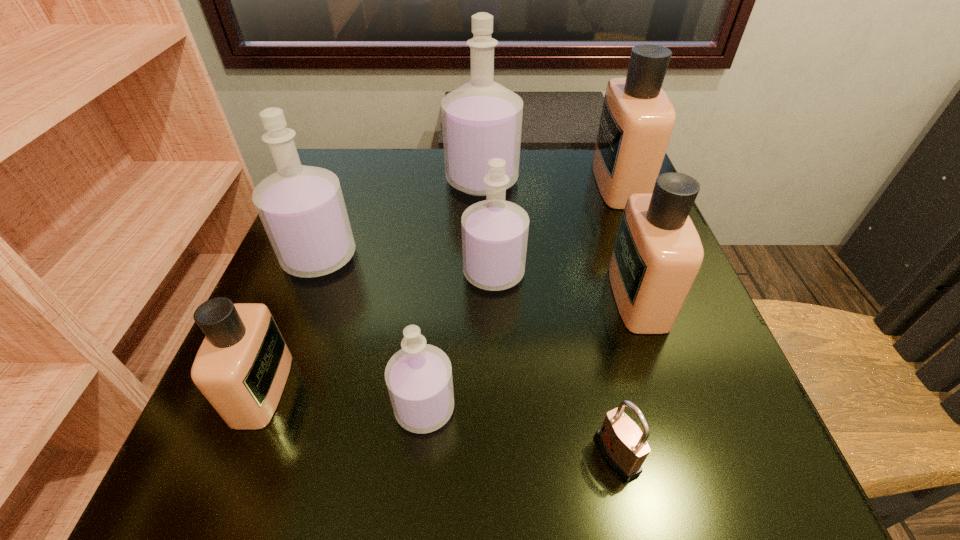
At what (x,y) coordinates should I click in order to perform the action: click on padlock. Please return your answer as a coordinate pair (x, y). The width and height of the screenshot is (960, 540). Looking at the image, I should click on (624, 446).

You are a GUI agent. You are given a task and a screenshot of the screen. Output one action in this format:
    pyautogui.click(x=<x>, y=<y>)
    Task: Click on the vacant area situated 0.290m on the right of the tallest object
    
    Given the screenshot: What is the action you would take?
    pyautogui.click(x=637, y=180)

You are a GUI agent. You are given a task and a screenshot of the screen. Output one action in this format:
    pyautogui.click(x=<x>, y=<y>)
    Task: Click on the vacant space located on the front label of the biggest beige perfume
    The height and width of the screenshot is (540, 960).
    Given the screenshot: What is the action you would take?
    pyautogui.click(x=483, y=183)

You are a GUI agent. You are given a task and a screenshot of the screen. Output one action in this format:
    pyautogui.click(x=<x>, y=<y>)
    Task: Click on the vacant space situated 0.280m on the front label of the biggest beige perfume
    This screenshot has height=540, width=960.
    Given the screenshot: What is the action you would take?
    pyautogui.click(x=479, y=183)

Locate an element on the screen. free region located 0.060m on the front label of the biggest beige perfume is located at coordinates (571, 183).

Where is `vacant space located 0.050m on the right of the third smallest purple perfume`? The image size is (960, 540). vacant space located 0.050m on the right of the third smallest purple perfume is located at coordinates (381, 256).

The image size is (960, 540). I want to click on vacant area located on the left of the third biggest purple perfume, so click(432, 273).

Find the location of `vacant point located 0.110m on the front label of the second biggest beige perfume`. vacant point located 0.110m on the front label of the second biggest beige perfume is located at coordinates (552, 296).

Locate an element on the screen. Image resolution: width=960 pixels, height=540 pixels. free region located 0.340m on the front label of the second biggest beige perfume is located at coordinates (425, 296).

The height and width of the screenshot is (540, 960). I want to click on vacant region located 0.270m on the front label of the second biggest beige perfume, so click(464, 296).